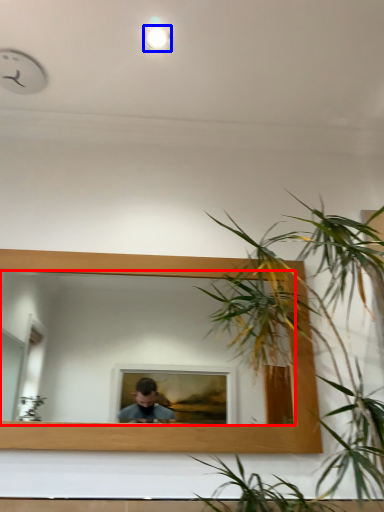
Question: Which point is closer to the camera, mirror (highlighted by a red box) or light (highlighted by a blue box)?

Choices:
 (A) mirror
 (B) light

Answer: (A)